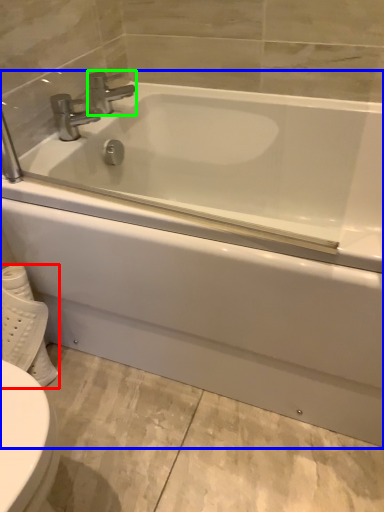
Question: Considering the real-world distances, which object is closest to toilet paper (highlighted by a red box)? bathtub (highlighted by a blue box) or tap (highlighted by a green box).

Choices:
 (A) bathtub
 (B) tap

Answer: (A)